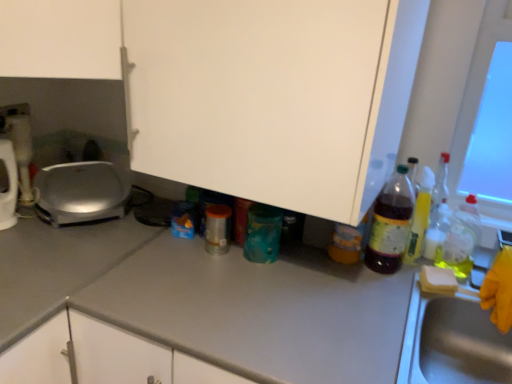
The image size is (512, 384). In order to click on free space above gray matte countertop at center (from a real-world perspective) in this screenshot , I will do point(65,241).